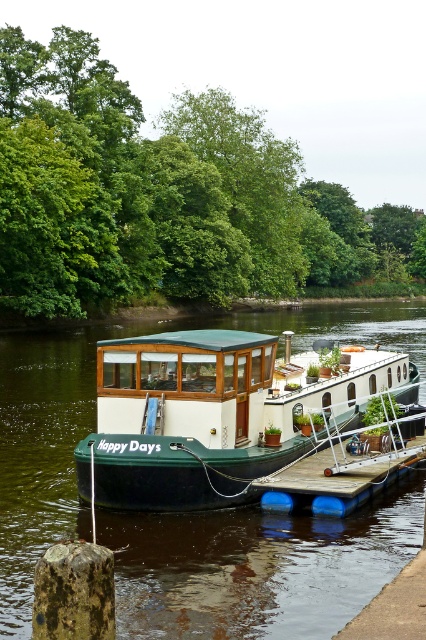
You are a delivery drone flying over a river and need to drop off a package to the green matte boat at center. According to the coordinates provided, where should you aim your delivery? Please state the coordinates in the format of a point like this example format point format example format point format example format point format example format point format example format point format example format point format example format point format example format point format example format point format example.

The green matte boat at center is located at coordinates point (256, 566). You should aim your delivery at point (256, 566).

You are a delivery drone flying over a calm river. You need to land on the deck of the green matte boat at center. According to the coordinates provided, where should you aim your landing? Please state the coordinates in the format of a point like this example format for clarity and precision.

The green matte boat at center is located at coordinates point (256, 566). Aim for that point to land on the deck.